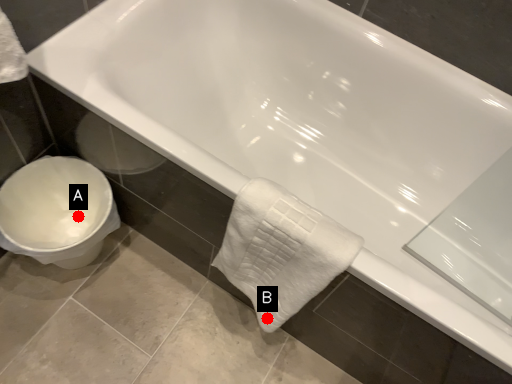
Question: Two points are circled on the image, labeled by A and B beside each circle. Which of the following is the farthest from the observer?

Choices:
 (A) A is further
 (B) B is further

Answer: (A)